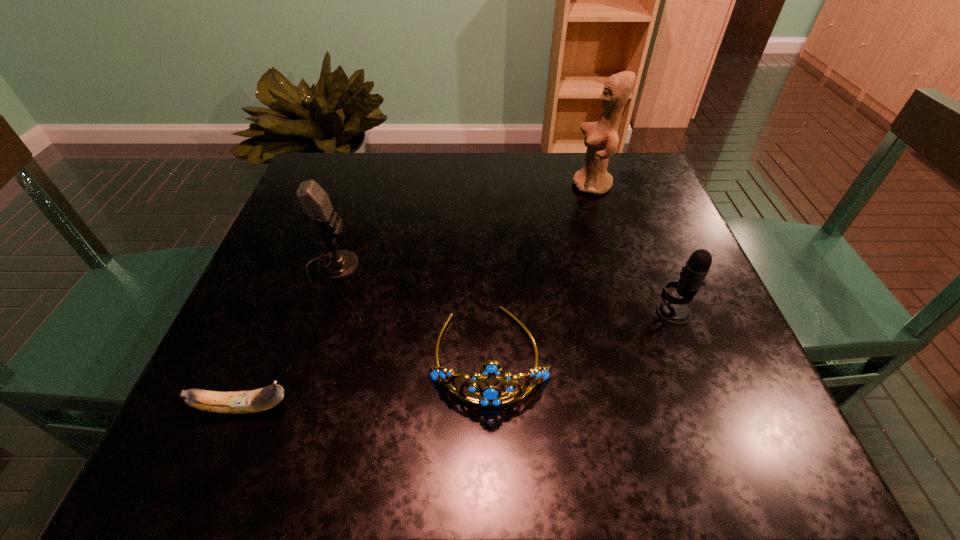
Find the location of a particular element. This screenshot has height=540, width=960. vacant space located on the front-facing side of the figurine is located at coordinates [545, 185].

This screenshot has height=540, width=960. I want to click on vacant area situated on the front-facing side of the figurine, so click(478, 185).

You are a GUI agent. You are given a task and a screenshot of the screen. Output one action in this format:
    pyautogui.click(x=<x>, y=<y>)
    Task: Click on the vacant area situated on the front-facing side of the fourth shortest object
    This screenshot has width=960, height=540.
    Given the screenshot: What is the action you would take?
    pyautogui.click(x=527, y=268)

The width and height of the screenshot is (960, 540). What are the coordinates of `vacant space located on the left of the nearer microphone` in the screenshot? It's located at (454, 312).

The height and width of the screenshot is (540, 960). What are the coordinates of `vacant space situated 0.110m at the stem of the shortest object` in the screenshot? It's located at point(366,408).

Locate an element on the screen. This screenshot has height=540, width=960. object that is at the far edge is located at coordinates (601, 138).

Locate an element on the screen. object at the near edge is located at coordinates (238, 402).

Identify the location of microphone that is at the left edge. (314, 201).

Find the location of a particular element. banana positioned at the left edge is located at coordinates (238, 402).

The image size is (960, 540). What are the coordinates of `figurine present at the right edge` in the screenshot? It's located at (601, 138).